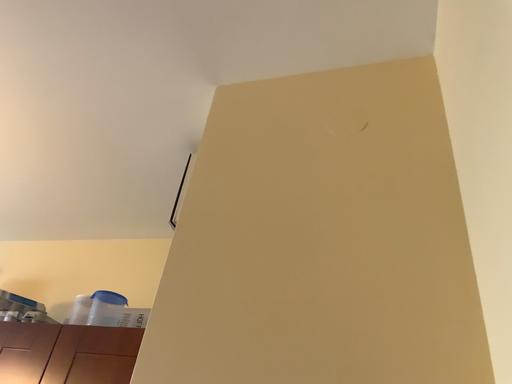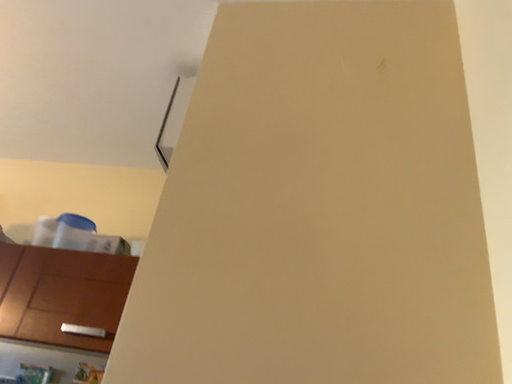
Question: How did the camera likely rotate when shooting the video?

Choices:
 (A) rotated right
 (B) rotated left

Answer: (A)